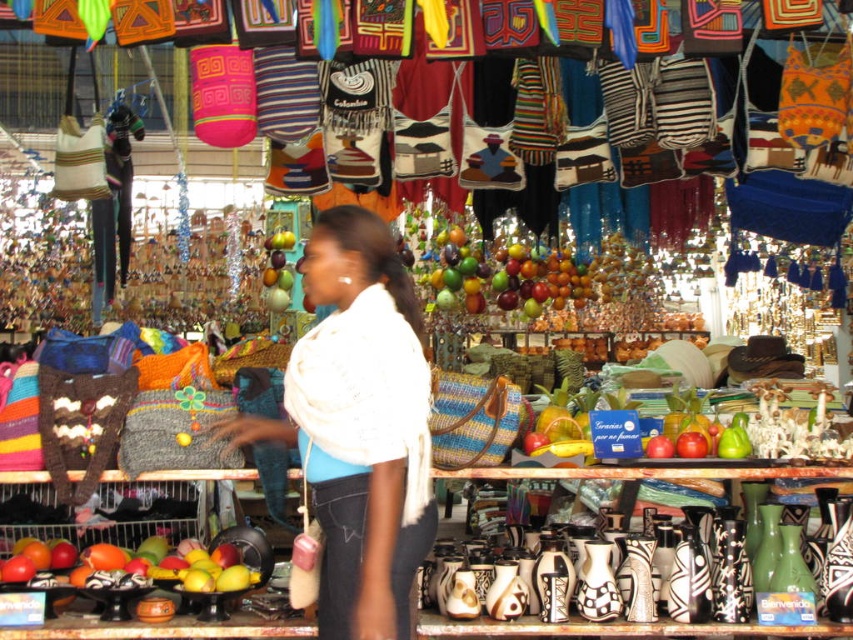
Question: In this image, where is white soft scarf at center located relative to mangoes at center?

Choices:
 (A) below
 (B) above

Answer: (B)

Question: Considering the relative positions of white soft scarf at center and mangoes at center in the image provided, where is white soft scarf at center located with respect to mangoes at center?

Choices:
 (A) left
 (B) right

Answer: (B)

Question: Which point is closer to the camera?

Choices:
 (A) white soft scarf at center
 (B) glossy plastic fruit at center
 (C) mangoes at center

Answer: (A)

Question: Which is nearer to the mangoes at center?

Choices:
 (A) white soft scarf at center
 (B) glossy plastic fruit at center

Answer: (A)

Question: Is glossy plastic fruit at center positioned behind mangoes at center?

Choices:
 (A) yes
 (B) no

Answer: (A)

Question: Which object is positioned closest to the glossy plastic fruit at center?

Choices:
 (A) mangoes at center
 (B) white soft scarf at center

Answer: (B)